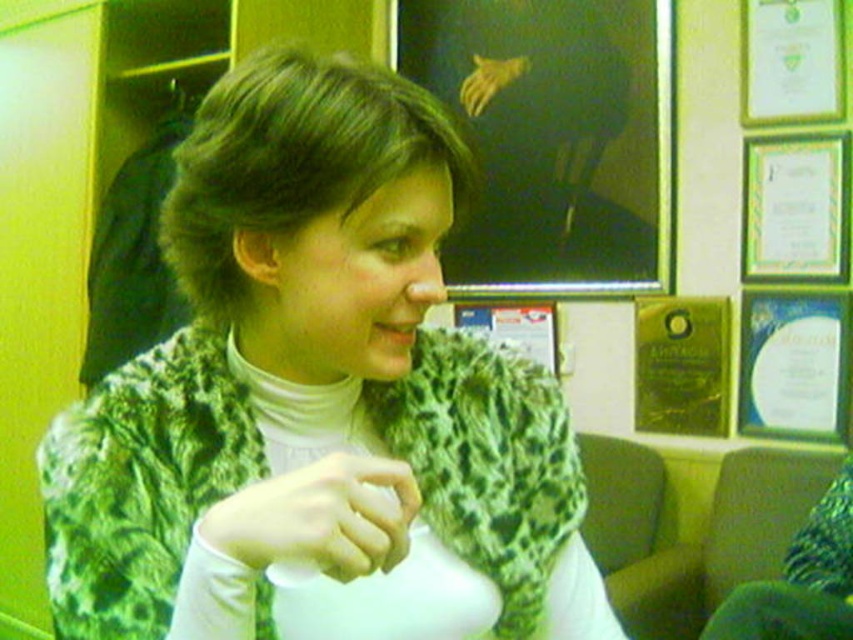
Based on the photo, you are an interior designer assessing the layout of this office. You need to determine if the green matte hand at center can reach the matte black board at upper center without moving its position. Based on their spatial relationship, what is your assessment?

The matte black board at upper center is further to the viewer than the green matte hand at center, so the hand is closer to the board. Therefore, the green matte hand at center can reach the matte black board at upper center without moving its position.